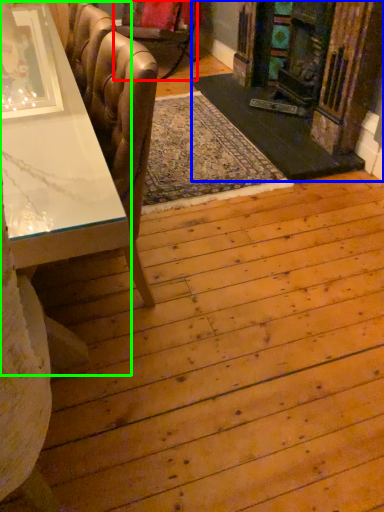
Question: Estimate the real-world distances between objects in this image. Which object is closer to chair (highlighted by a red box), fireplace (highlighted by a blue box) or table (highlighted by a green box)?

Choices:
 (A) fireplace
 (B) table

Answer: (A)